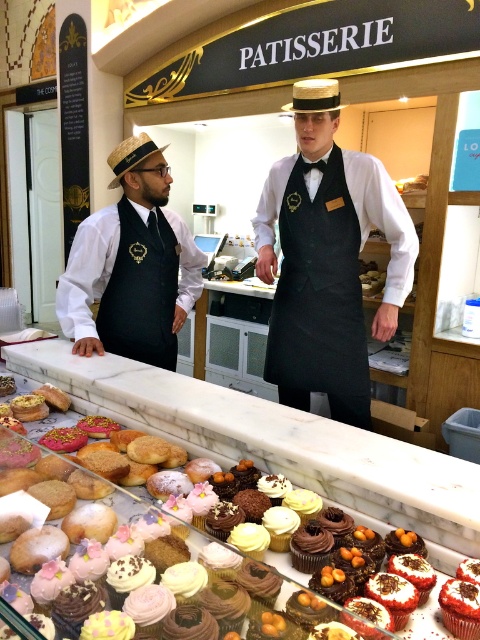
You are a customer at the patisserie and want to know which apron is bigger between the black matte apron at center and the black fabric apron at left. Can you tell me which one is larger?

The black matte apron at center is larger than the black fabric apron at left.

You are standing in front of the patisserie display case and see two points marked on the glass. The first point is at coordinates point (132,144) and the second is at point (168,310). Which point do you see closer to you?

Point (132,144) is closer to the camera than point (168,310), so you see the first point closer to you.